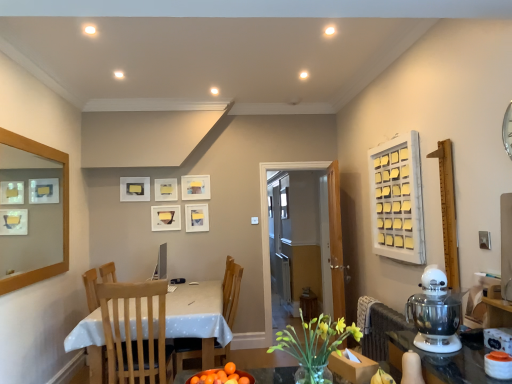
Question: Can you confirm if wooden chair at center, the first chair positioned from the back, is taller than white dotted fabric at lower left?

Choices:
 (A) yes
 (B) no

Answer: (A)

Question: From a real-world perspective, is wooden chair at center, which is counted as the second chair, starting from the front, over white dotted fabric at lower left?

Choices:
 (A) yes
 (B) no

Answer: (A)

Question: Does wooden chair at center, the first chair positioned from the back, appear on the left side of white dotted fabric at lower left?

Choices:
 (A) yes
 (B) no

Answer: (B)

Question: Considering the relative sizes of wooden chair at center, which is counted as the second chair, starting from the front, and white dotted fabric at lower left in the image provided, is wooden chair at center, which is counted as the second chair, starting from the front, shorter than white dotted fabric at lower left?

Choices:
 (A) no
 (B) yes

Answer: (A)

Question: Does wooden chair at center, which is counted as the second chair, starting from the front, appear on the right side of white dotted fabric at lower left?

Choices:
 (A) no
 (B) yes

Answer: (B)

Question: Is matte white picture frame at upper center, arranged as the 4th picture frame when viewed from the left, in front of or behind light wood chair at center, marked as the 2th chair in a back-to-front arrangement, in the image?

Choices:
 (A) behind
 (B) front

Answer: (A)

Question: In terms of height, does matte white picture frame at upper center, arranged as the 4th picture frame when viewed from the left, look taller or shorter compared to light wood chair at center, marked as the 2th chair in a back-to-front arrangement?

Choices:
 (A) short
 (B) tall

Answer: (A)

Question: Would you say matte white picture frame at upper center, arranged as the 4th picture frame when viewed from the left, is to the left or to the right of light wood chair at center, the 1th chair in the front-to-back sequence, in the picture?

Choices:
 (A) right
 (B) left

Answer: (A)

Question: Looking at the image, does matte white picture frame at upper center, which is the 2th picture frame in right-to-left order, seem bigger or smaller compared to light wood chair at center, marked as the 2th chair in a back-to-front arrangement?

Choices:
 (A) big
 (B) small

Answer: (B)

Question: Looking at the image, does light wood chair at center, marked as the 2th chair in a back-to-front arrangement, seem bigger or smaller compared to transparent glass window at center, which appears as the second window when viewed from the front?

Choices:
 (A) small
 (B) big

Answer: (B)

Question: Considering their positions, is light wood chair at center, the 1th chair in the front-to-back sequence, located in front of or behind transparent glass window at center, which appears as the second window when viewed from the right?

Choices:
 (A) behind
 (B) front

Answer: (B)

Question: Is light wood chair at center, marked as the 2th chair in a back-to-front arrangement, inside or outside of transparent glass window at center, which ranks as the 1th window in left-to-right order?

Choices:
 (A) outside
 (B) inside

Answer: (A)

Question: From a real-world perspective, is light wood chair at center, the 1th chair in the front-to-back sequence, above or below transparent glass window at center, which appears as the second window when viewed from the front?

Choices:
 (A) below
 (B) above

Answer: (A)

Question: Do you think yellow glass vase at center is within transparent glass door at center, or outside of it?

Choices:
 (A) outside
 (B) inside

Answer: (A)

Question: In terms of width, does yellow glass vase at center look wider or thinner when compared to transparent glass door at center?

Choices:
 (A) thin
 (B) wide

Answer: (B)